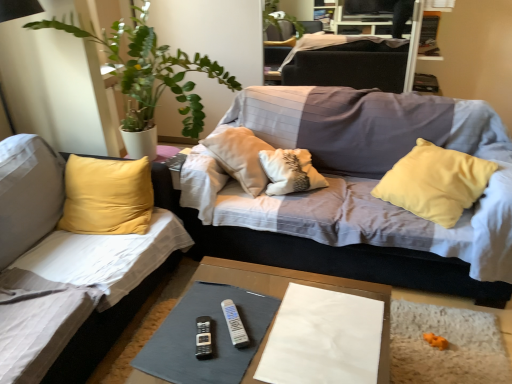
Locate an element on the screen. empty space that is in between white plastic remote at center, which is the 1th remote from right to left, and white paper at center is located at coordinates (261, 317).